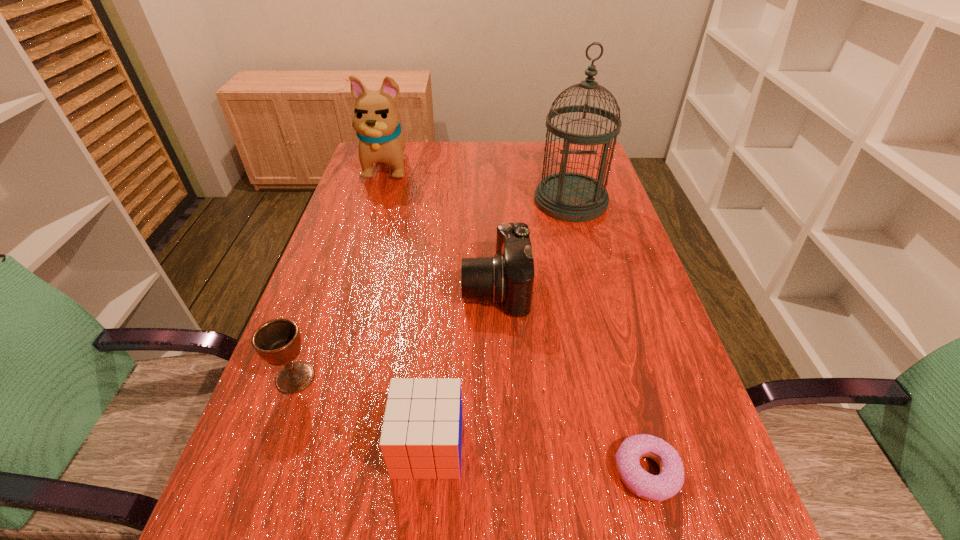
Locate an element on the screen. This screenshot has width=960, height=540. free point that satisfies the following two spatial constraints: 1. on the lens of the fourth nearest object; 2. on the right side of the doughnut is located at coordinates (502, 472).

Locate an element on the screen. The height and width of the screenshot is (540, 960). free region that satisfies the following two spatial constraints: 1. on the lens of the third farthest object; 2. on the back side of the doughnut is located at coordinates (502, 472).